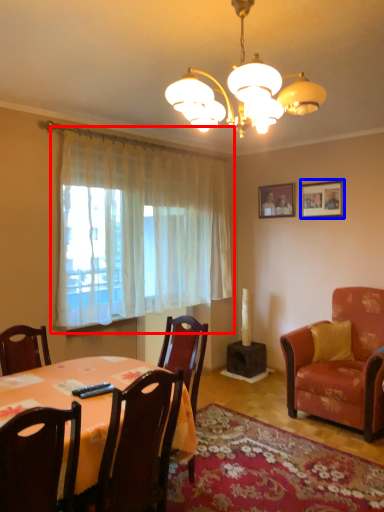
Question: Which object is further to the camera taking this photo, curtain (highlighted by a red box) or picture frame (highlighted by a blue box)?

Choices:
 (A) curtain
 (B) picture frame

Answer: (B)